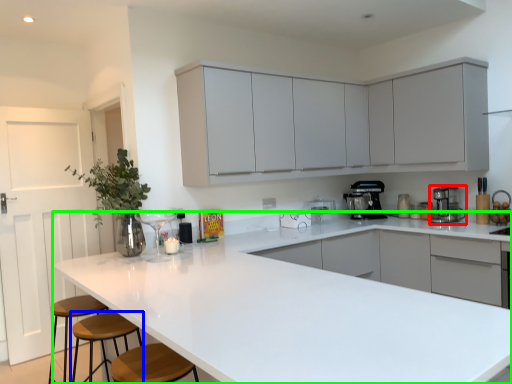
Question: Considering the real-world distances, which object is closest to home appliance (highlighted by a red box)? bar stool (highlighted by a blue box) or countertop (highlighted by a green box).

Choices:
 (A) bar stool
 (B) countertop

Answer: (B)